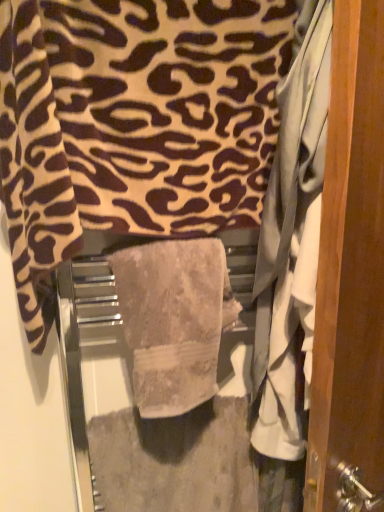
At what (x,y) coordinates should I click in order to perform the action: click on free space above beige textured towel at center, which is counted as the first towel, starting from the bottom (from a real-world perspective). Please return your answer as a coordinate pair (x, y). This screenshot has height=512, width=384. Looking at the image, I should click on (160, 240).